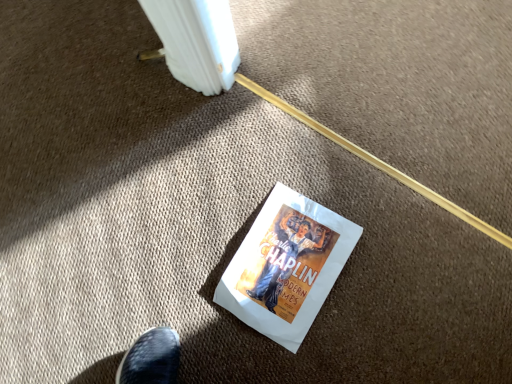
I want to click on free location to the right of white paper at center, so click(x=391, y=220).